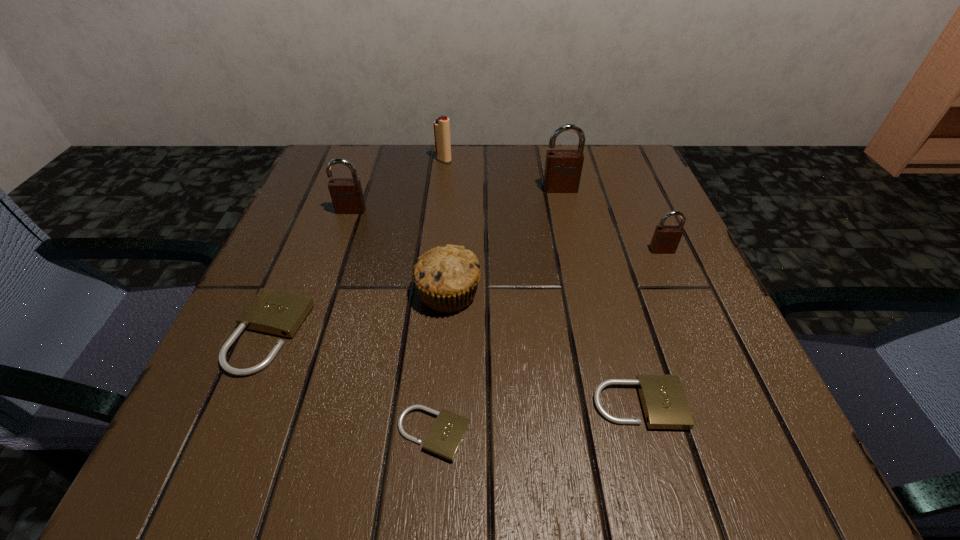
The height and width of the screenshot is (540, 960). In order to click on the biggest brown padlock in this screenshot , I will do `click(563, 168)`.

At what (x,y) coordinates should I click in order to perform the action: click on the farthest brown padlock. Please return your answer as a coordinate pair (x, y). Looking at the image, I should click on (563, 168).

I want to click on the second tallest padlock, so click(x=346, y=194).

Find the location of `the second smallest brown padlock`. the second smallest brown padlock is located at coordinates (346, 194).

In order to click on red igniter in this screenshot , I will do `click(442, 125)`.

Where is `igniter`? The height and width of the screenshot is (540, 960). igniter is located at coordinates (442, 125).

You are a GUI agent. You are given a task and a screenshot of the screen. Output one action in this format:
    pyautogui.click(x=<x>, y=<y>)
    Task: Click on the muffin
    
    Given the screenshot: What is the action you would take?
    pyautogui.click(x=447, y=277)

Where is `the fifth nearest object`? The width and height of the screenshot is (960, 540). the fifth nearest object is located at coordinates (666, 238).

Locate an element on the screen. the rightmost object is located at coordinates (666, 238).

Where is `the fourth farthest padlock`? The height and width of the screenshot is (540, 960). the fourth farthest padlock is located at coordinates (274, 312).